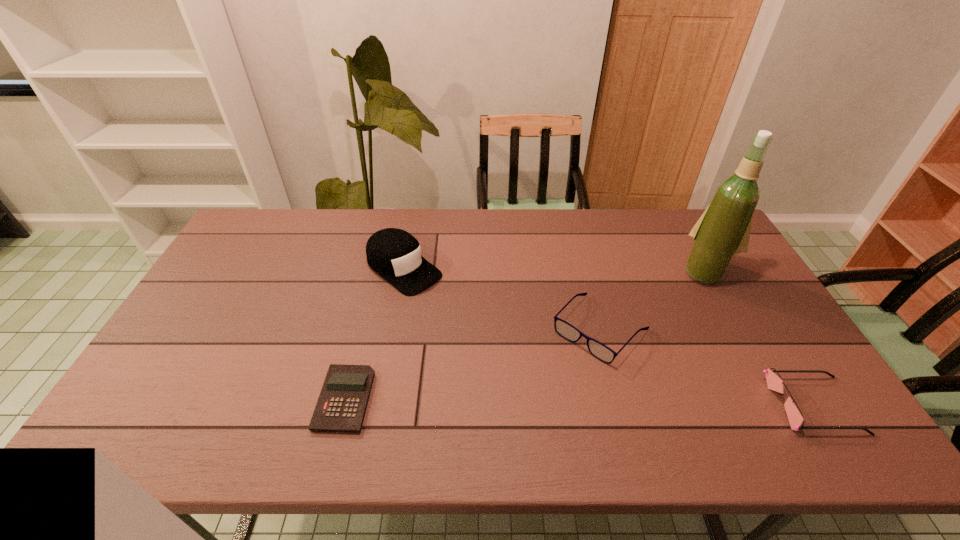
What are the coordinates of `the shortest object` in the screenshot? It's located at (341, 407).

Locate an element on the screen. sunglasses is located at coordinates click(x=775, y=383).

The height and width of the screenshot is (540, 960). Find the location of `the tallest object`. the tallest object is located at coordinates (723, 230).

The width and height of the screenshot is (960, 540). I want to click on the second tallest object, so click(394, 254).

Find the location of a particular element. The width and height of the screenshot is (960, 540). the third object from left to right is located at coordinates (600, 351).

At what (x,y) coordinates should I click in order to perform the action: click on blank area located 0.120m on the left of the calculator. Please return your answer as a coordinate pair (x, y). The image size is (960, 540). Looking at the image, I should click on (271, 399).

You are a GUI agent. You are given a task and a screenshot of the screen. Output one action in this format:
    pyautogui.click(x=<x>, y=<y>)
    Task: Click on the free location located on the front-facing side of the tallest object
    The image size is (960, 540).
    Given the screenshot: What is the action you would take?
    pyautogui.click(x=665, y=330)

I want to click on vacant region located 0.290m on the front-facing side of the tallest object, so click(x=659, y=340).

Where is `vacant region located 0.380m on the front-facing side of the tallest object`? This screenshot has height=540, width=960. vacant region located 0.380m on the front-facing side of the tallest object is located at coordinates (644, 361).

The height and width of the screenshot is (540, 960). I want to click on blank space located on the front-facing side of the cap, so click(477, 325).